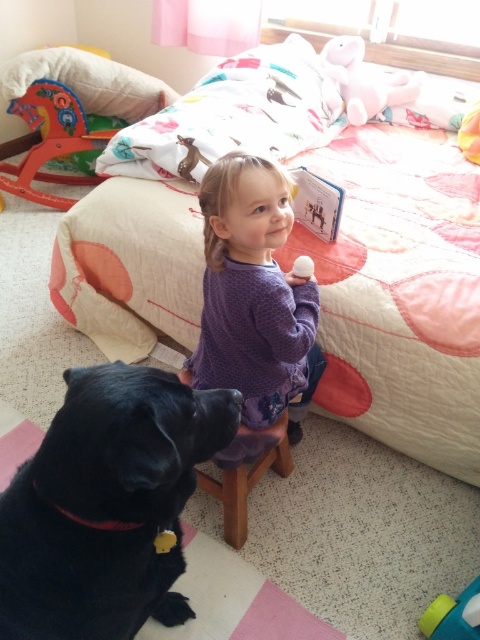
You are a parent trying to dress your child in the purple dotted sweater at center. The wooden stool at lower center is where the child is sitting. Can the child reach the sleeves of the sweater while sitting on the stool?

The purple dotted sweater at center is taller than wooden stool at lower center. Since the sweater is taller than the stool, the child can easily reach the sleeves of the purple dotted sweater at center while sitting on the wooden stool at lower center.

Looking at this image, you are standing in the room and want to place a small toy at point (276, 244). If your hand is currently at 1 meter away from the camera, do you need to move your hand forward or backward to reach that point?

The point (276, 244) is 1.15 meters away from the camera. Since your hand is currently at 1 meter away, you need to move your hand forward by 0.15 meters to reach that point.

You are a parent trying to dress your child in the purple dotted sweater at center. The child is holding the pink plush bear at upper center. Can the child put on the sweater while still holding the bear?

The purple dotted sweater at center is bigger than the pink plush bear at upper center, so the child can put on the sweater while holding the bear because the sweater is larger and should accommodate the bear in their arms.